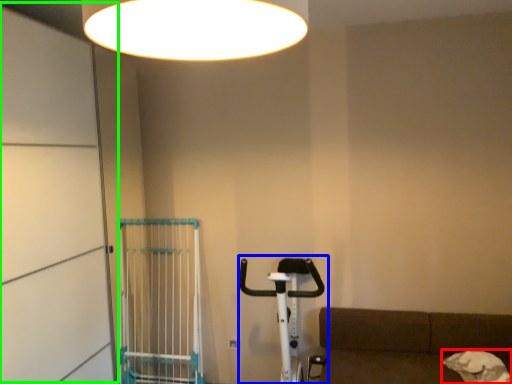
Question: Which object is the closest to the dog (highlighted by a red box)? Choose among these: baby carriage (highlighted by a blue box) or screen door (highlighted by a green box).

Choices:
 (A) baby carriage
 (B) screen door

Answer: (A)